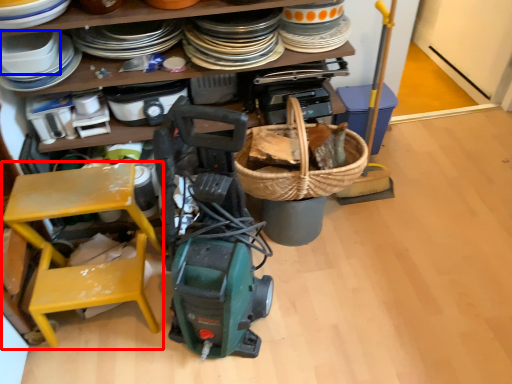
Question: Which object is closer to the camera taking this photo, chair (highlighted by a red box) or appliance (highlighted by a blue box)?

Choices:
 (A) chair
 (B) appliance

Answer: (A)